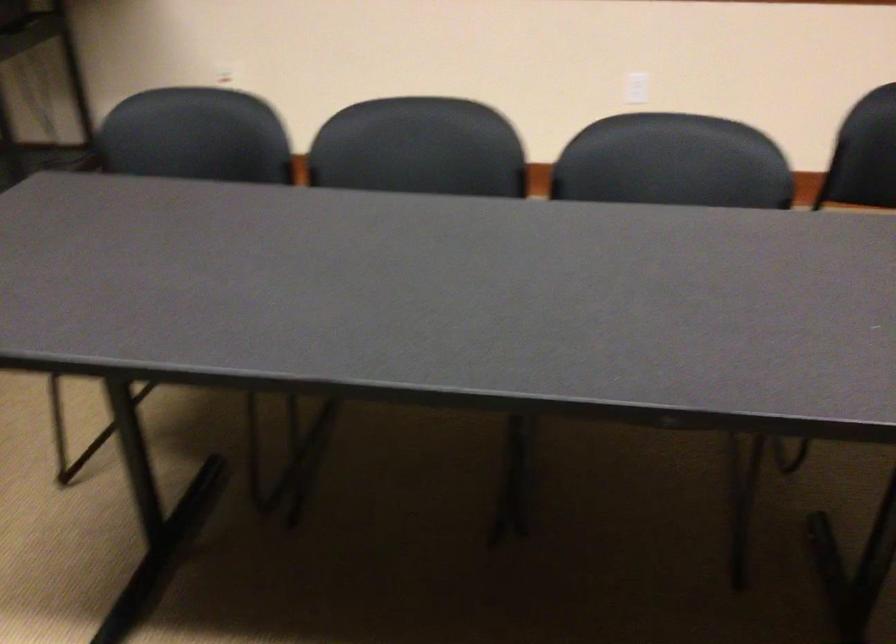
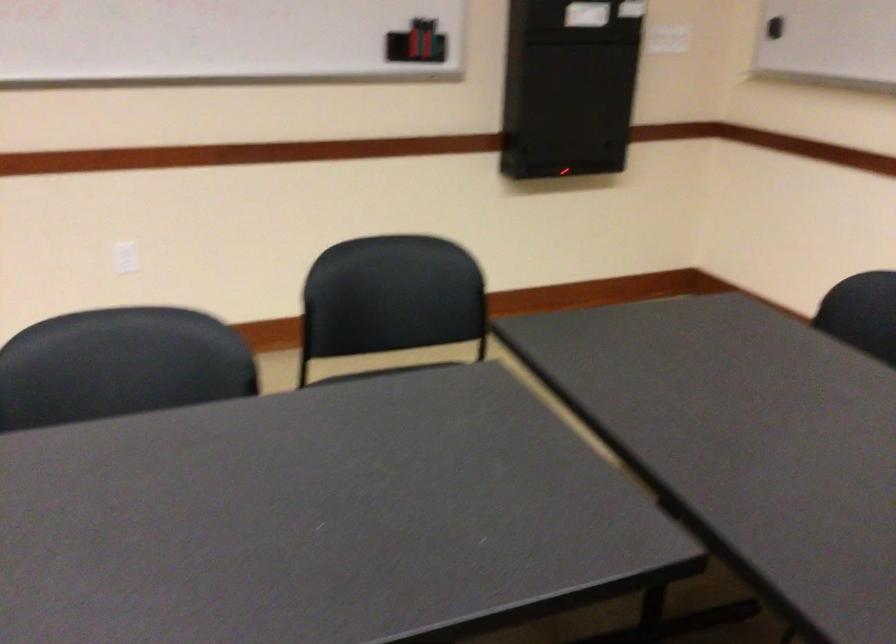
Question: Based on the continuous images, in which direction is the camera rotating? Reply with the corresponding letter.

Choices:
 (A) Left
 (B) Right
 (C) Up
 (D) Down

Answer: (B)